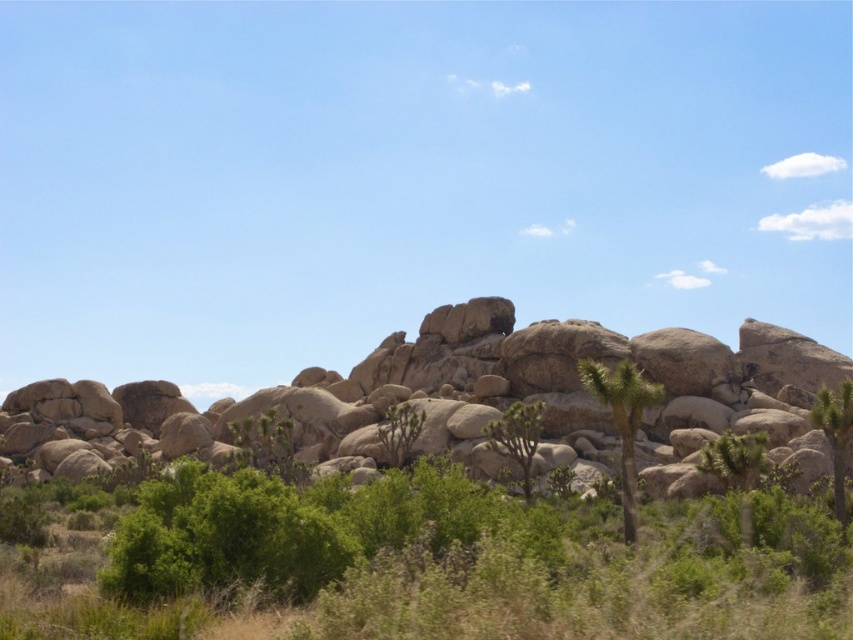
You are standing at the center of the desert scene. You want to walk towards the green leafy tree at right. Which direction should you face to head directly towards it?

The green leafy tree at right is positioned at point 0.681 on the x axis and 0.980 on the y axis. Since you are at the center, you should face towards the right and slightly upwards to head directly towards the green leafy tree at right.

You are navigating through the desert and see two points marked in the image. Which point is closer to you, point (844, 420) or point (386, 440)?

Point (844, 420) is in front of point (386, 440), so it is closer to you.